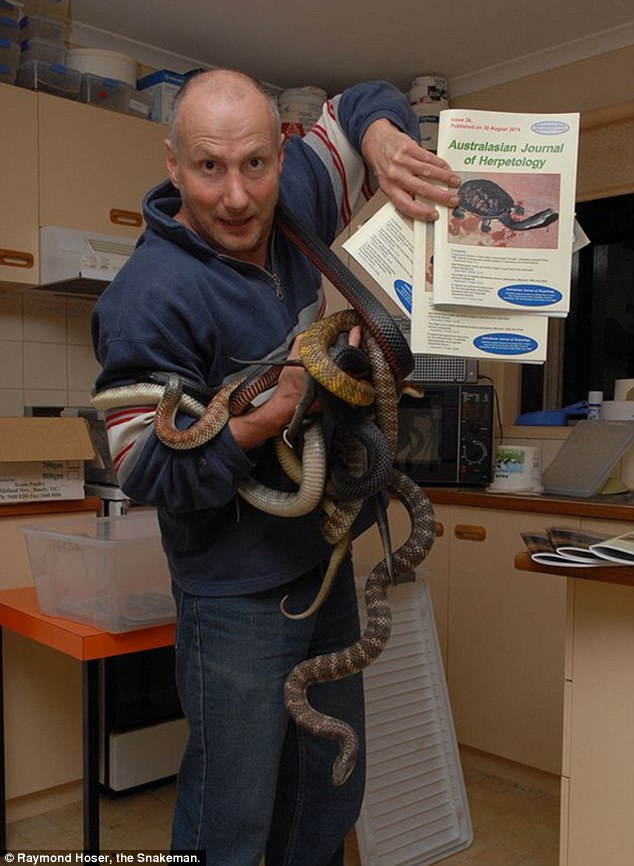
Identify the location of microwave. This screenshot has width=634, height=866. (423, 436).